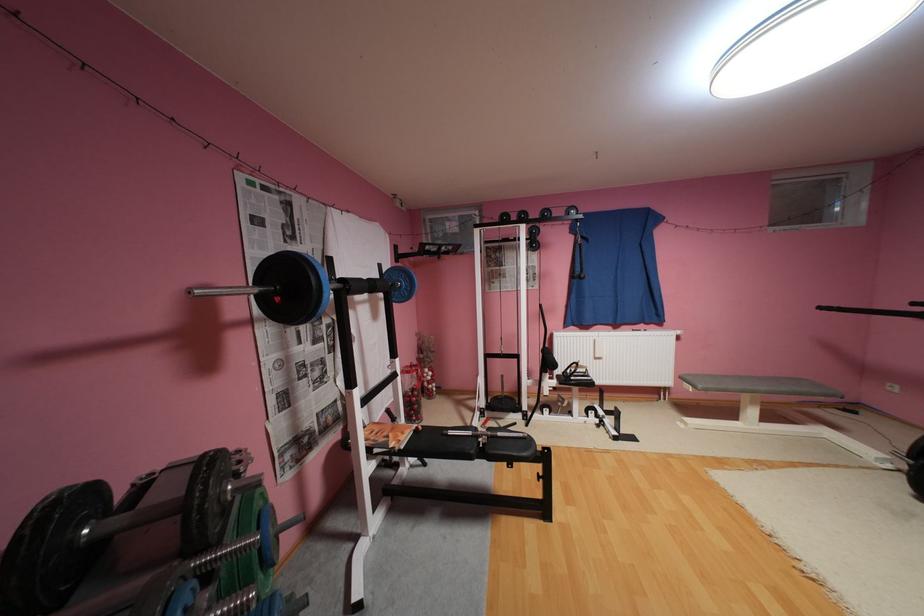
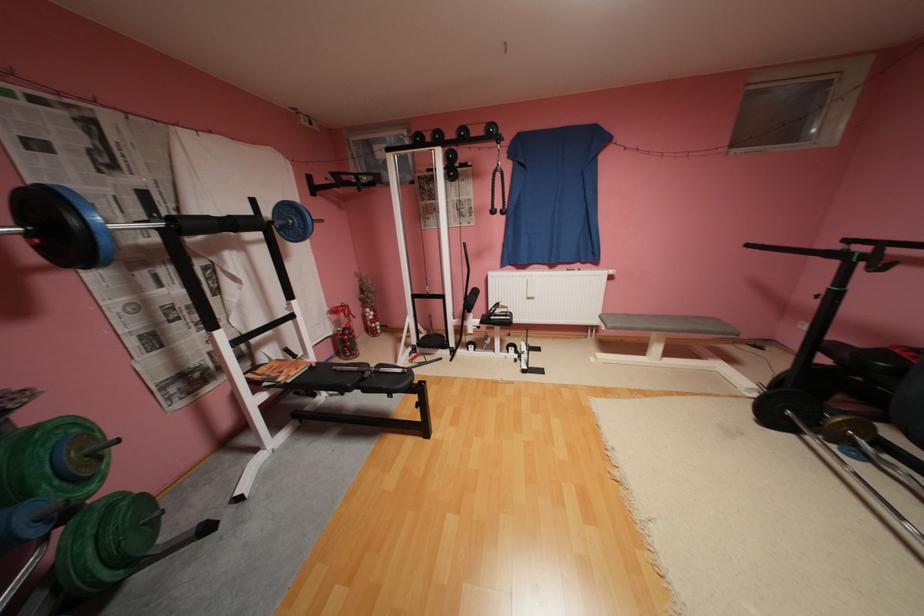
Where in the second image is the point corresponding to point 830,308 from the first image?

(757, 246)